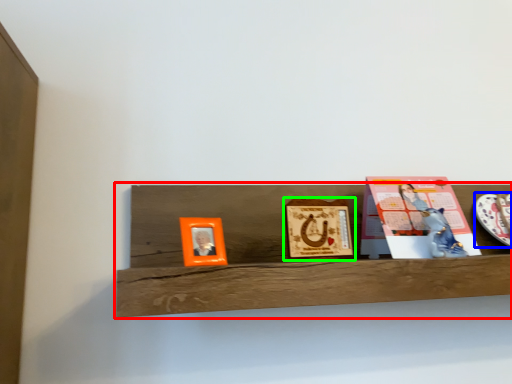
Question: Which object is positioned closest to shelf (highlighted by a red box)? Select from platter (highlighted by a blue box) and picture frame (highlighted by a green box).

Choices:
 (A) platter
 (B) picture frame

Answer: (B)